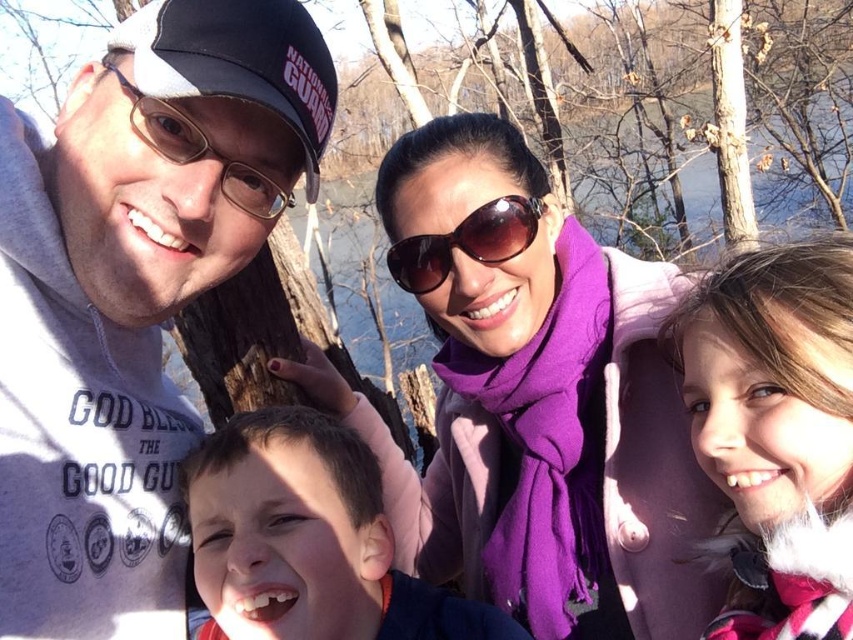
You are a photographer trying to capture a closeup of the purple wool scarf at center and the brown reflective sunglasses at center. Given that your camera has a maximum focus range of 10 cm, can you determine if both items are within this range?

The purple wool scarf at center and brown reflective sunglasses at center are both at center, so they are likely within the camera focus range of 10 cm. However, the description does not provide exact distances between the photographer and the objects, so it is uncertain.

You are a photographer trying to capture a closeup shot of both the brown reflective sunglasses at center and the matte black goggles at left. Given that your camera can only focus on objects within a 50 centimeter range, will you be able to capture both items in a single focused shot?

The brown reflective sunglasses at center and matte black goggles at left are 55.40 centimeters apart. Since the camera can only focus within 50 centimeters, the distance between them exceeds the camera range, so you cannot capture both in a single focused shot.